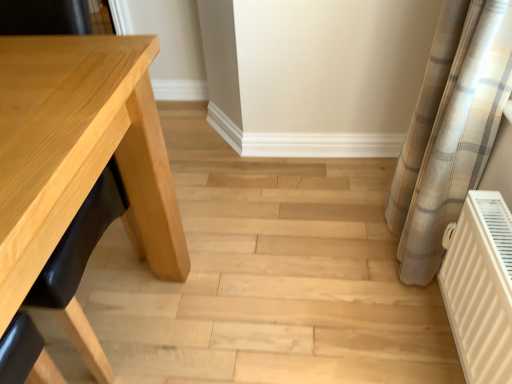
Where is `free spot below white matte radiator at lower right (from a real-world perspective)`? The height and width of the screenshot is (384, 512). free spot below white matte radiator at lower right (from a real-world perspective) is located at coordinates (437, 337).